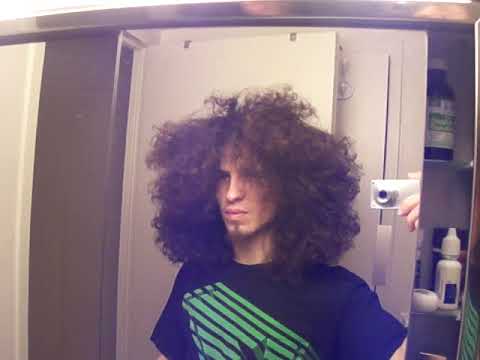
Where is `door`? The height and width of the screenshot is (360, 480). door is located at coordinates (294, 58).